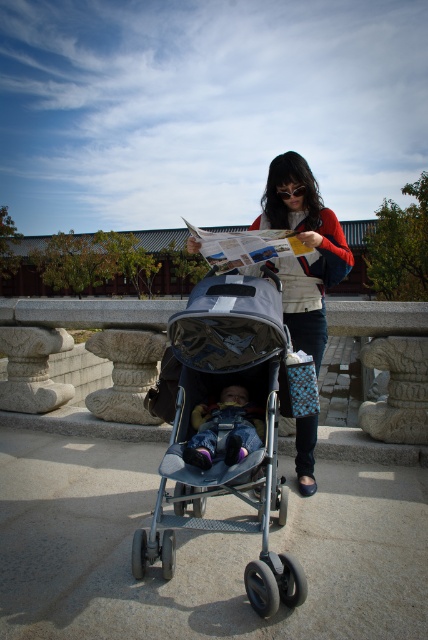
You are a photographer trying to capture the stroller and the woman in the best possible way. You want to ensure that both the stroller and the woman are clearly visible in your photo. Given their positions at point coordinates point (x=261, y=349) and point (x=312, y=209) respectively, which one should you focus on first to ensure both are in focus?

You should focus on point (x=261, y=349) first because it is closer to the viewer than point (x=312, y=209). By focusing on the closer point, the depth of field may naturally include the farther point in focus as well.

You are standing at a distance of 10 feet from the point marked as point (297, 161). Can you reach it without moving closer?

The distance of point (297, 161) from viewer is 9.68 feet, so yes, you can reach it without moving closer since it is within the 10 feet range.